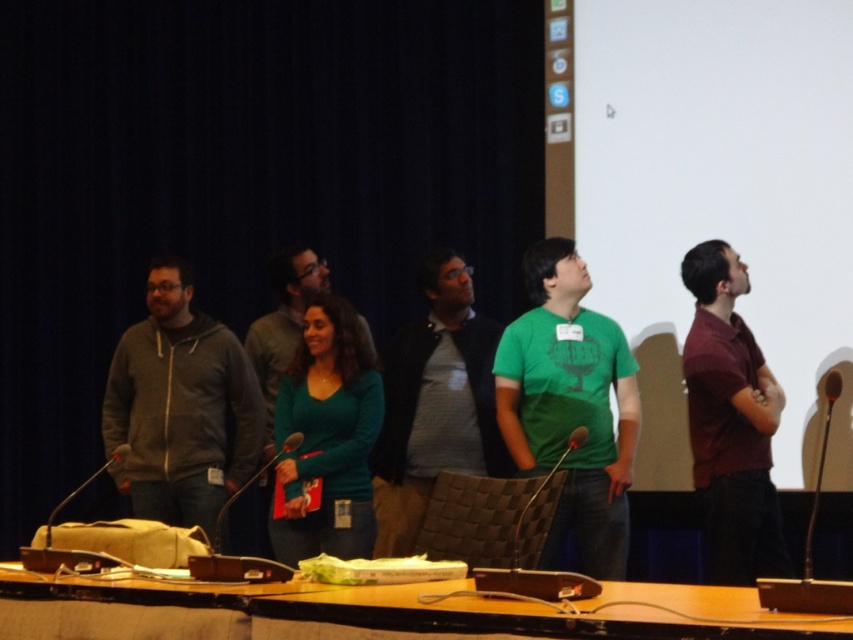
Question: Can you confirm if green matte shirt at center is positioned below maroon shirt at right?

Choices:
 (A) no
 (B) yes

Answer: (A)

Question: Is matte gray shirt at center closer to the viewer compared to teal matte sweater at center?

Choices:
 (A) yes
 (B) no

Answer: (B)

Question: Estimate the real-world distances between objects in this image. Which object is closer to the maroon shirt at right?

Choices:
 (A) green matte shirt at center
 (B) teal matte sweater at center
 (C) gray zip-up hoodie at center
 (D) matte gray shirt at center

Answer: (A)

Question: Which of the following is the farthest from the observer?

Choices:
 (A) teal matte sweater at center
 (B) gray zip-up hoodie at center

Answer: (B)

Question: Can you confirm if matte gray shirt at center is positioned below teal matte sweater at center?

Choices:
 (A) yes
 (B) no

Answer: (B)

Question: Which point is closer to the camera?

Choices:
 (A) (718, 502)
 (B) (151, 304)

Answer: (A)